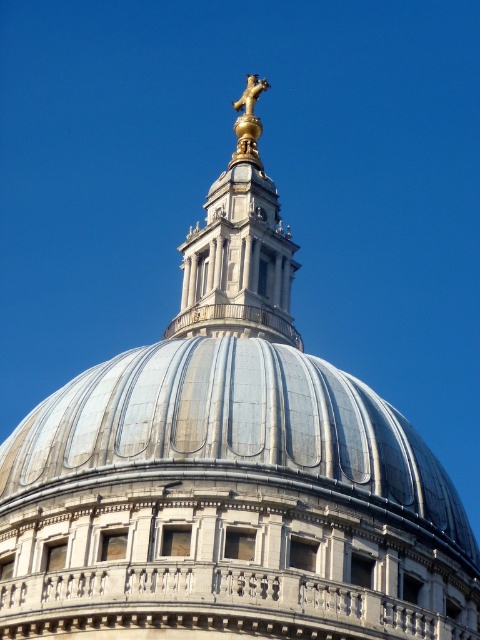
You are a tour guide explaining the architecture of St. Paul Cathedral. You want to mention the distance between the two gold polished statues. How far apart are the gold polished statue at upper center and the gold polished statue at top?

The gold polished statue at upper center and the gold polished statue at top are 6.57 meters apart from each other.

Looking at this image, you are standing in front of St. Paul Cathedral and want to take a photo of the silver metallic dome at center. If you move 0.5 meters to the right, will the dome still be in the frame?

The silver metallic dome at center is located at point (236, 433), so moving 0.5 meters to the right might move the dome out of the frame depending on the camera angle and zoom. However, without specific camera parameters, it is difficult to determine precisely.